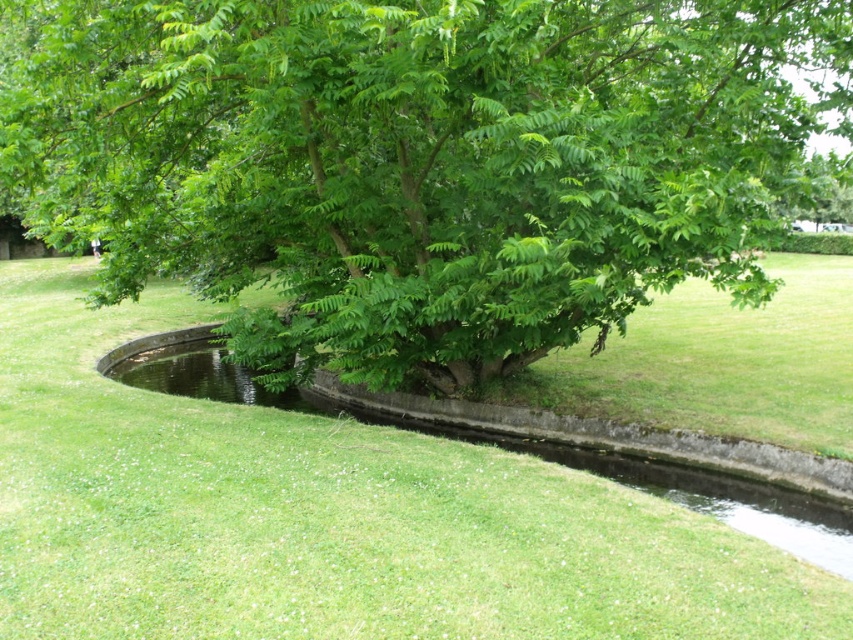
Who is positioned more to the right, green leafy tree at center or clear water at center?

From the viewer's perspective, green leafy tree at center appears more on the right side.

Is point (294, 132) more distant than point (299, 410)?

No, it is in front of (299, 410).

Locate an element on the screen. green leafy tree at center is located at coordinates (416, 161).

Measure the distance from green grassy at center to clear water at center.

They are 8.75 feet apart.

Is point (664, 621) closer to viewer compared to point (111, 362)?

Yes, it is in front of point (111, 362).

Find the location of a particular element. The width and height of the screenshot is (853, 640). green grassy at center is located at coordinates (325, 515).

Is green leafy tree at center smaller than green grassy at center?

No.

Which is in front, point (669, 131) or point (480, 449)?

Positioned in front is point (669, 131).

Where is `green leafy tree at center`? green leafy tree at center is located at coordinates (416, 161).